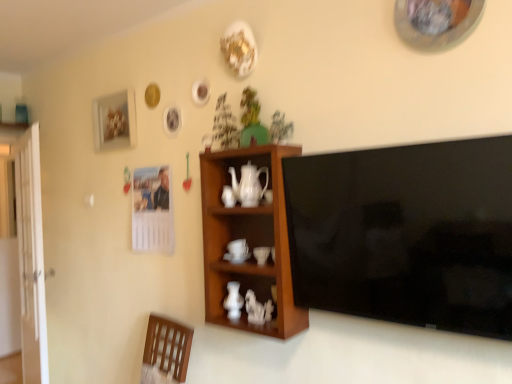
Question: Can you confirm if white glossy door at left is bigger than white glossy teapot at center?

Choices:
 (A) yes
 (B) no

Answer: (A)

Question: From the image's perspective, is white glossy door at left located above white glossy teapot at center?

Choices:
 (A) yes
 (B) no

Answer: (B)

Question: Considering the relative positions of white glossy door at left and white glossy teapot at center in the image provided, is white glossy door at left to the right of white glossy teapot at center from the viewer's perspective?

Choices:
 (A) no
 (B) yes

Answer: (A)

Question: Does white glossy door at left have a lesser height compared to white glossy teapot at center?

Choices:
 (A) no
 (B) yes

Answer: (A)

Question: From the image's perspective, is white glossy door at left beneath white glossy teapot at center?

Choices:
 (A) no
 (B) yes

Answer: (B)

Question: Is white glossy door at left smaller than white glossy teapot at center?

Choices:
 (A) yes
 (B) no

Answer: (B)

Question: Are matte white picture frame at upper left and wooden cabinet at center located far from each other?

Choices:
 (A) yes
 (B) no

Answer: (B)

Question: Does matte white picture frame at upper left come in front of wooden cabinet at center?

Choices:
 (A) no
 (B) yes

Answer: (A)

Question: Can you confirm if matte white picture frame at upper left is thinner than wooden cabinet at center?

Choices:
 (A) yes
 (B) no

Answer: (A)

Question: Are matte white picture frame at upper left and wooden cabinet at center beside each other?

Choices:
 (A) yes
 (B) no

Answer: (B)

Question: Is matte white picture frame at upper left turned away from wooden cabinet at center?

Choices:
 (A) yes
 (B) no

Answer: (B)

Question: Is matte white picture frame at upper left to the left of wooden cabinet at center from the viewer's perspective?

Choices:
 (A) yes
 (B) no

Answer: (A)

Question: Is green matte houseplant at upper center, which is the first houseplant from right to left, not within wooden cabinet at center?

Choices:
 (A) no
 (B) yes

Answer: (B)